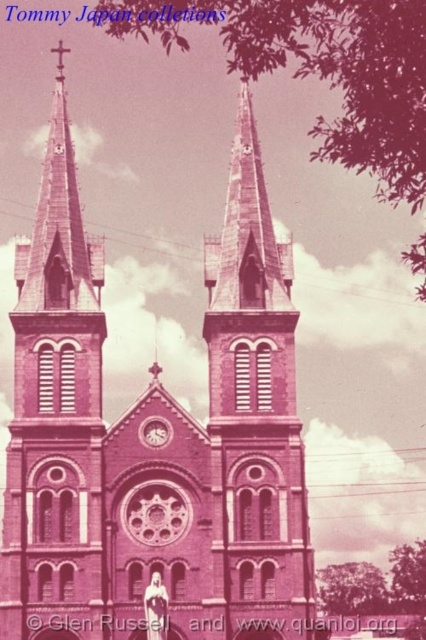
Question: Which is farther from the matte pink clock at upper center?

Choices:
 (A) pink stone tower at center
 (B) pink stone church at center
 (C) matte glass clock at center
 (D) pink stone church steeple at center

Answer: (C)

Question: Which point is farther from the camera taking this photo?

Choices:
 (A) (62, 154)
 (B) (43, 385)
 (C) (146, 426)

Answer: (A)

Question: Is pink stone church steeple at center to the right of pink stone tower at center from the viewer's perspective?

Choices:
 (A) no
 (B) yes

Answer: (A)

Question: Among these objects, which one is farthest from the camera?

Choices:
 (A) pink stone church at center
 (B) matte pink clock at upper center

Answer: (B)

Question: Can you confirm if pink stone church at center is thinner than matte glass clock at center?

Choices:
 (A) no
 (B) yes

Answer: (A)

Question: Is pink stone church steeple at center positioned behind matte glass clock at center?

Choices:
 (A) yes
 (B) no

Answer: (B)